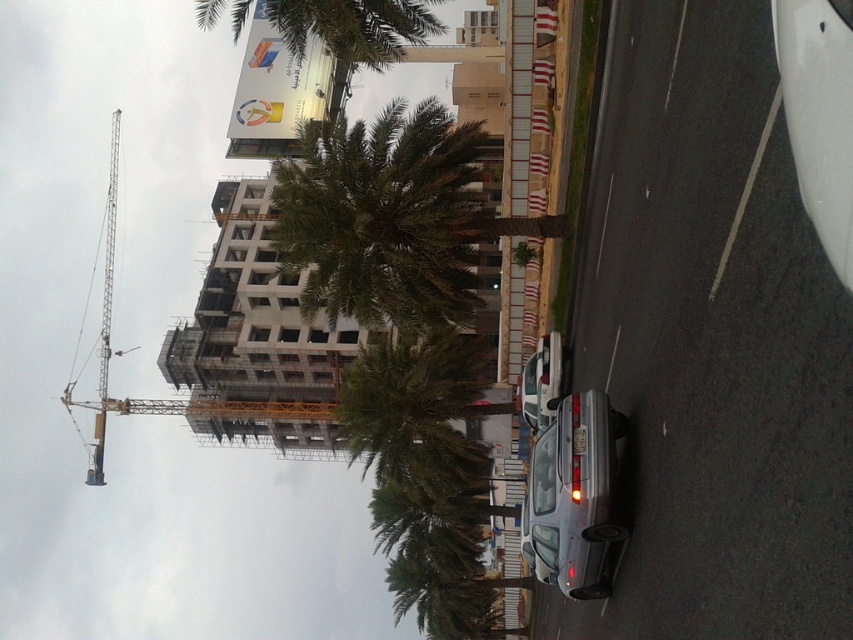
You are standing at the scene and want to take a photo of the green leafy palm tree at center. Your camera can focus on objects up to 60 meters away. Will the palm tree be in focus?

The green leafy palm tree at center is 58.54 meters away from viewer, which is within the camera focus range of 60 meters. Therefore, the palm tree will be in focus.

You are a delivery driver who needs to park your truck next to the satin silver sedan at center. The truck is 2.5 meters wide. Can you park it there without hitting the green leafy palm tree at upper center?

The green leafy palm tree at upper center might be wider than the satin silver sedan at center. Since the truck is 2.5 meters wide, if the palm tree is wider than the sedan, it could potentially block the parking space. However, without exact measurements, it is uncertain whether there will be enough space. Please check the actual width before proceeding.

You are a delivery driver who needs to park your vehicle in the area shown. You see the green leafy palm tree at upper center and the satin silver sedan at center. Which object is located above the other?

The green leafy palm tree at upper center is positioned over the satin silver sedan at center, meaning the palm tree is above the sedan.